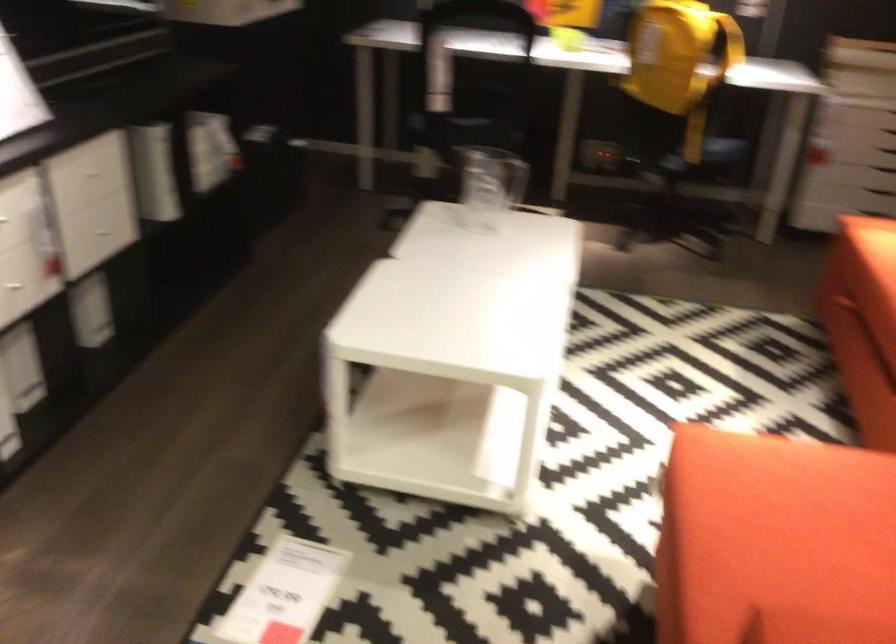
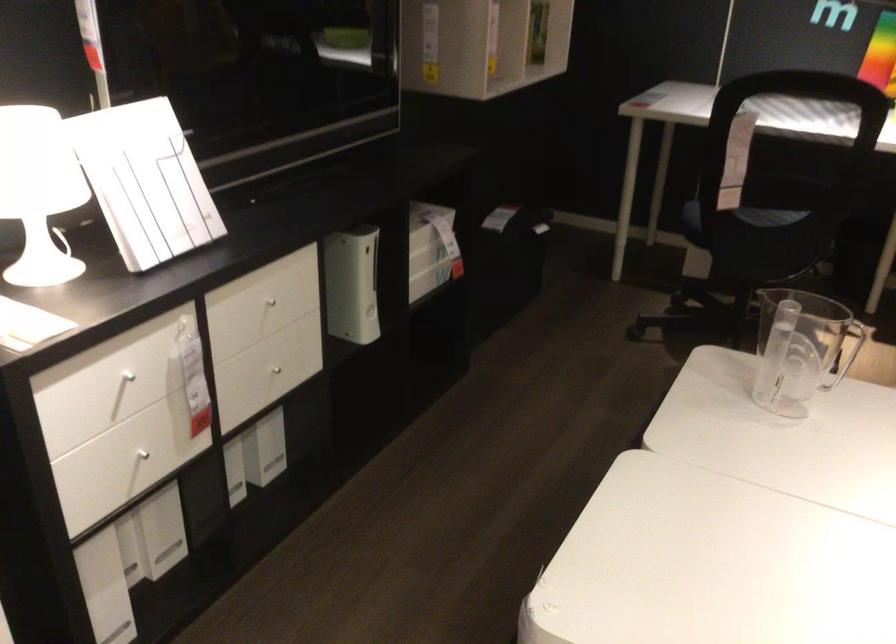
Where in the second image is the point corresponding to (x=107, y=234) from the first image?

(279, 366)